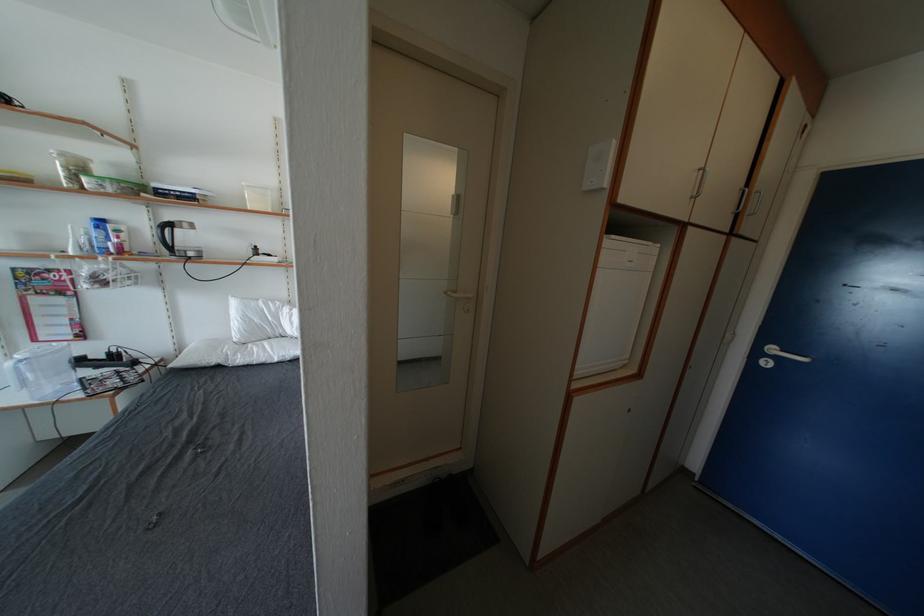
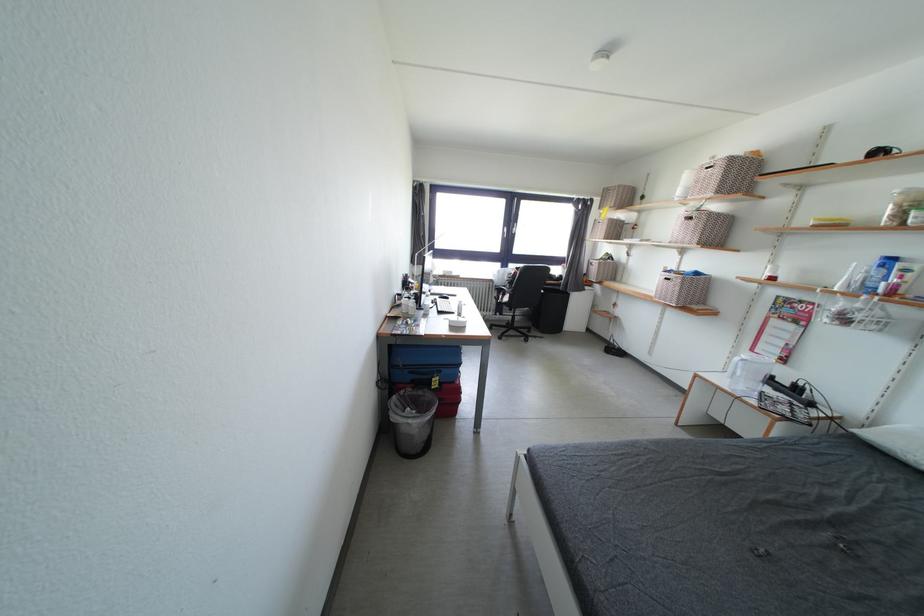
In the second image, find the point that corresponds to [181,369] in the first image.

(869, 438)